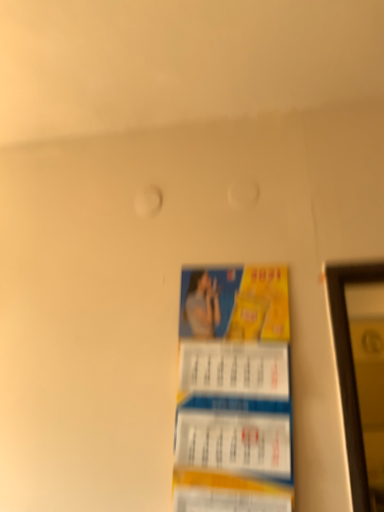
What is the approximate height of yellow paper poster at center?

yellow paper poster at center is 26.56 inches tall.

At what (x,y) coordinates should I click in order to perform the action: click on yellow paper poster at center. Please return your answer as a coordinate pair (x, y). Image resolution: width=384 pixels, height=512 pixels. Looking at the image, I should click on (234, 391).

What do you see at coordinates (234, 391) in the screenshot?
I see `yellow paper poster at center` at bounding box center [234, 391].

At what (x,y) coordinates should I click in order to perform the action: click on yellow paper poster at center. Please return your answer as a coordinate pair (x, y). This screenshot has width=384, height=512. Looking at the image, I should click on (234, 391).